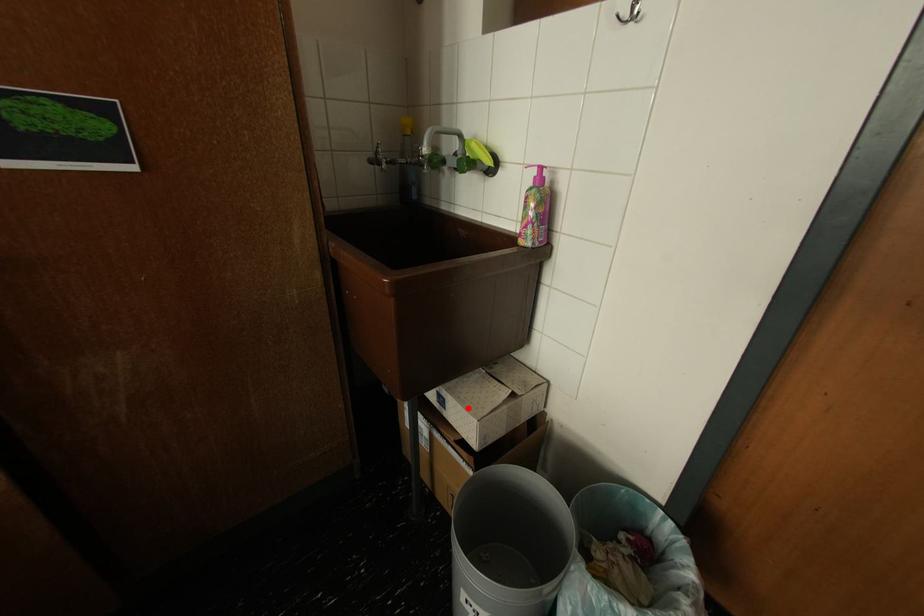
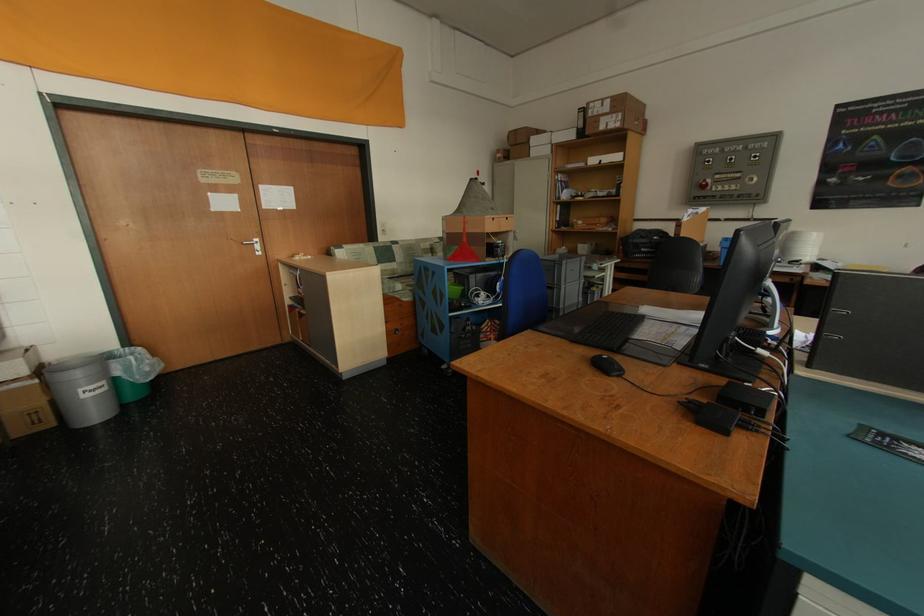
Locate, in the second image, the point that corresponds to the highlighted location in the first image.

(10, 363)